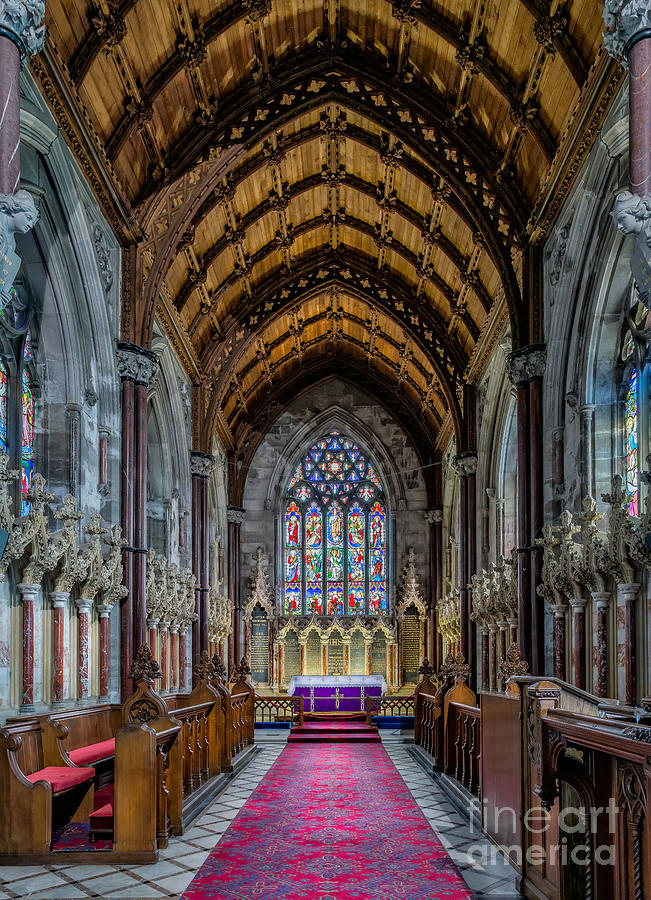
Locate an element on the screen. stairs is located at coordinates click(333, 740), click(333, 726).